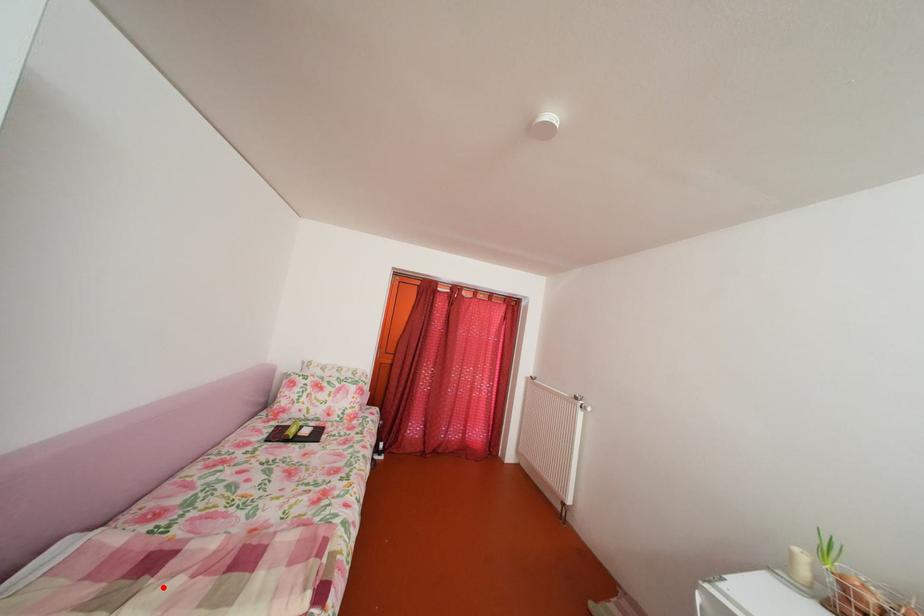
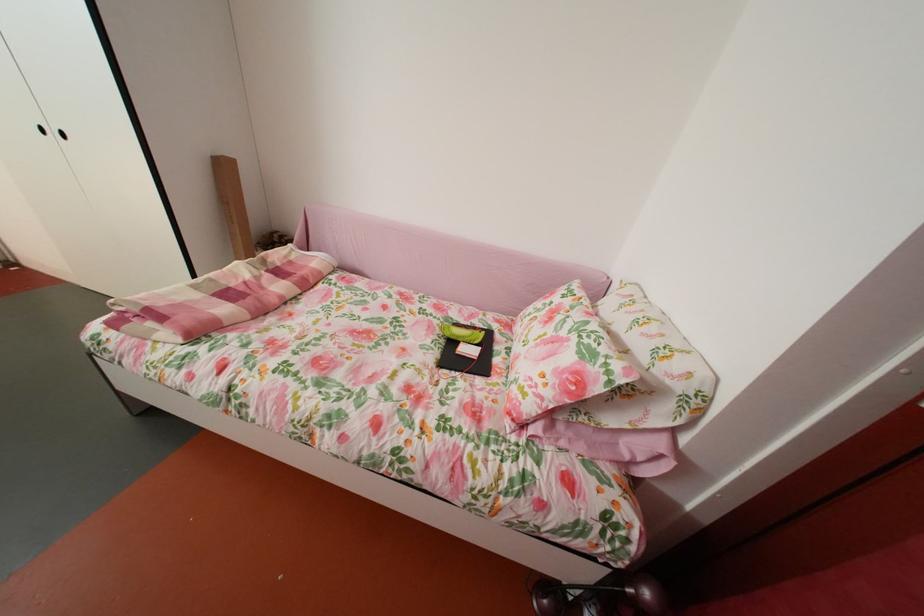
Find the pixel in the second image that matches the highlighted location in the first image.

(274, 278)